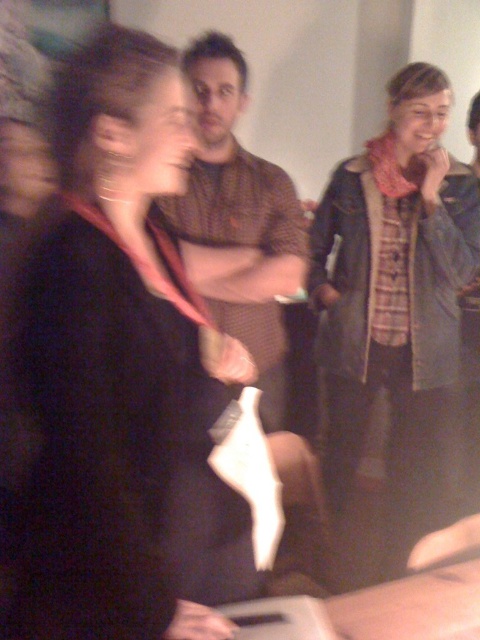
You are at a social gathering and see a person wearing a dark top with a red scarf. There is a point marked at coordinates (130, 381) in the image. What object is located at that point?

The point at coordinates (130, 381) corresponds to the matte black scarf at center.

You are organizing a costume party and need to ensure all guests have matching accessories. You notice two items at the center of the image. Which one is smaller in size between the matte black scarf at center and the brown textured shirt at center?

The matte black scarf at center is smaller in size compared to the brown textured shirt at center.

You are trying to locate the plaid fabric scarf at upper right in the image. Based on the scene description, where would you expect to find it?

The plaid fabric scarf at upper right is located at point (394, 324).